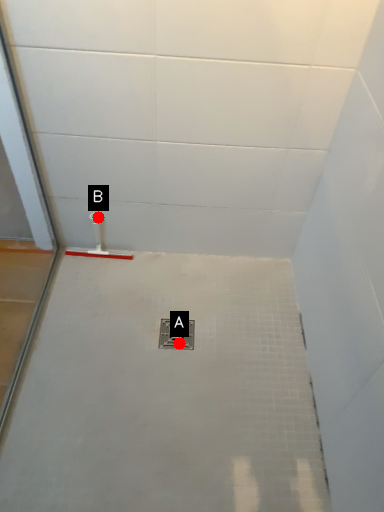
Question: Two points are circled on the image, labeled by A and B beside each circle. Among these points, which one is farthest from the camera?

Choices:
 (A) A is further
 (B) B is further

Answer: (B)